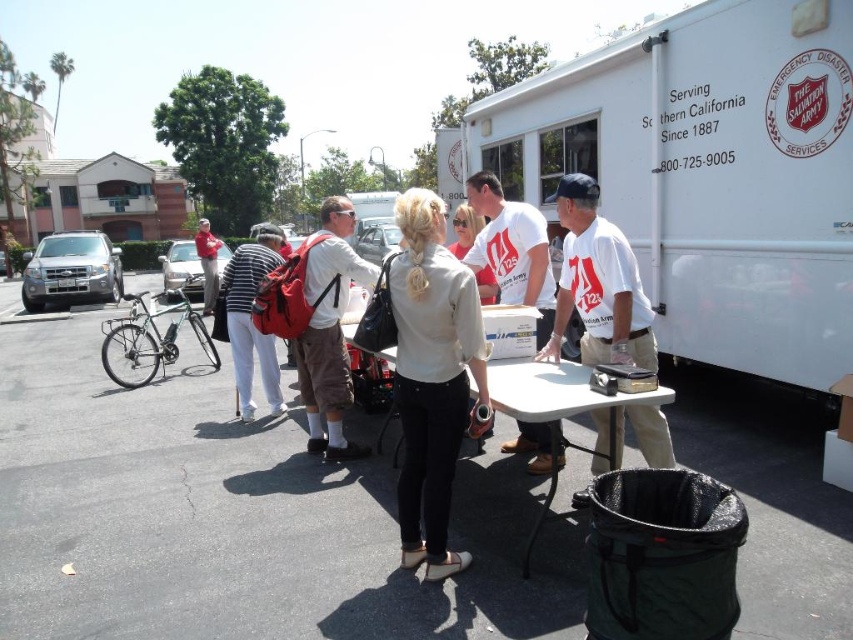
Can you confirm if matte red backpack at center is bigger than white cotton shirt at center?

Yes, matte red backpack at center is bigger than white cotton shirt at center.

Between matte red backpack at center and white cotton shirt at center, which one appears on the right side from the viewer's perspective?

white cotton shirt at center is more to the right.

Which is behind, point (347, 394) or point (537, 332)?

Point (347, 394)

Find the location of a particular element. matte red backpack at center is located at coordinates (329, 330).

Is matte red backpack at center to the right of striped cotton shirt at center from the viewer's perspective?

Indeed, matte red backpack at center is positioned on the right side of striped cotton shirt at center.

Consider the image. Is the position of matte red backpack at center more distant than that of striped cotton shirt at center?

No.

Who is more forward, (311, 292) or (241, 308)?

Point (311, 292) is in front.

This screenshot has height=640, width=853. I want to click on matte red backpack at center, so click(x=329, y=330).

Which is more to the right, white matte truck at center or white cotton shirt at center?

white matte truck at center is more to the right.

Which of these two, white matte truck at center or white cotton shirt at center, stands taller?

Standing taller between the two is white matte truck at center.

The height and width of the screenshot is (640, 853). Find the location of `white matte truck at center`. white matte truck at center is located at coordinates (708, 173).